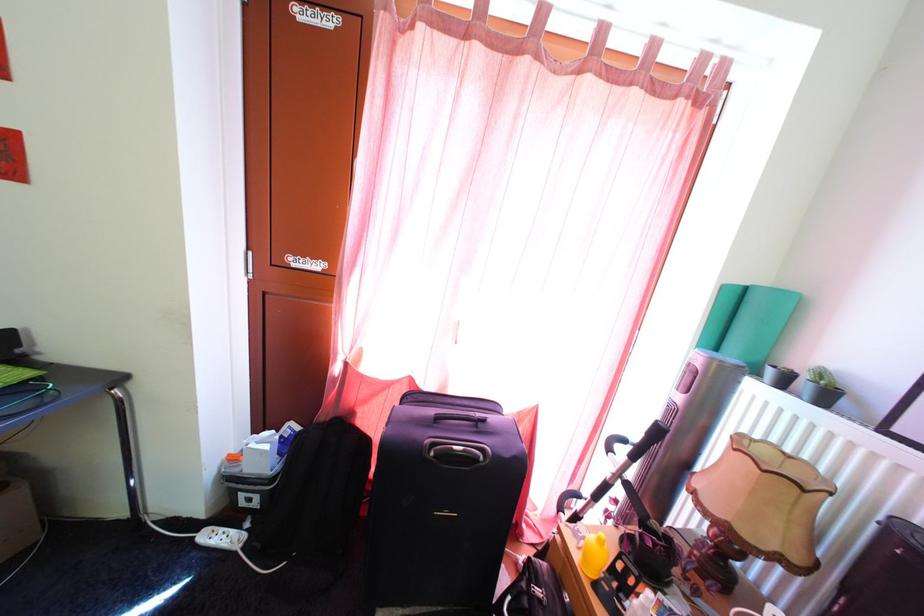
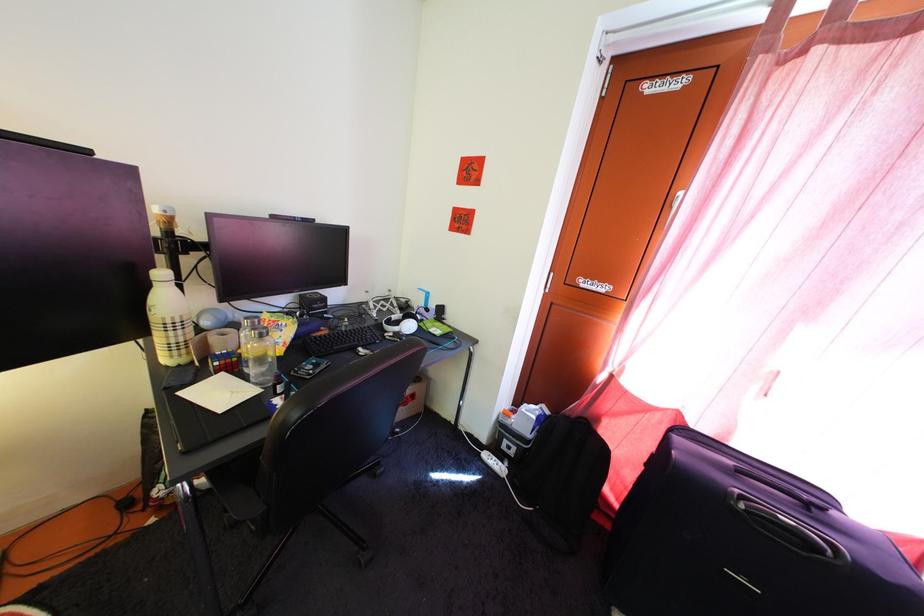
The point at [441,463] is marked in the first image. Where is the corresponding point in the second image?

(751, 515)